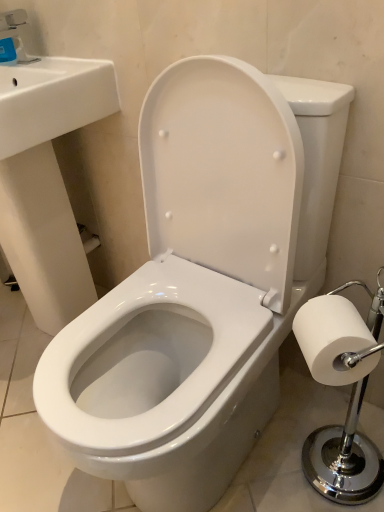
Question: Would you say matte blue plastic faucet at upper left is outside white paper at right?

Choices:
 (A) yes
 (B) no

Answer: (A)

Question: Is matte blue plastic faucet at upper left not near white paper at right?

Choices:
 (A) yes
 (B) no

Answer: (A)

Question: From the image's perspective, is matte blue plastic faucet at upper left on top of white paper at right?

Choices:
 (A) yes
 (B) no

Answer: (A)

Question: Does matte blue plastic faucet at upper left have a smaller size compared to white paper at right?

Choices:
 (A) yes
 (B) no

Answer: (A)

Question: Considering the relative sizes of matte blue plastic faucet at upper left and white paper at right in the image provided, is matte blue plastic faucet at upper left taller than white paper at right?

Choices:
 (A) yes
 (B) no

Answer: (A)

Question: Considering the positions of white paper at right and matte blue plastic faucet at upper left in the image, is white paper at right taller or shorter than matte blue plastic faucet at upper left?

Choices:
 (A) short
 (B) tall

Answer: (A)

Question: Is white paper at right to the left or to the right of matte blue plastic faucet at upper left in the image?

Choices:
 (A) right
 (B) left

Answer: (A)

Question: Considering the positions of point (314, 336) and point (23, 45), is point (314, 336) closer or farther from the camera than point (23, 45)?

Choices:
 (A) closer
 (B) farther

Answer: (A)

Question: From a real-world perspective, is white paper at right physically located above or below matte blue plastic faucet at upper left?

Choices:
 (A) below
 (B) above

Answer: (A)

Question: Based on their positions, is white glossy sink at upper left located to the left or right of matte blue plastic faucet at upper left?

Choices:
 (A) left
 (B) right

Answer: (B)

Question: Relative to matte blue plastic faucet at upper left, is white glossy sink at upper left in front or behind?

Choices:
 (A) behind
 (B) front

Answer: (B)

Question: Is white glossy sink at upper left bigger or smaller than matte blue plastic faucet at upper left?

Choices:
 (A) small
 (B) big

Answer: (B)

Question: From the image's perspective, is white glossy sink at upper left above or below matte blue plastic faucet at upper left?

Choices:
 (A) below
 (B) above

Answer: (A)

Question: In terms of width, does white glossy sink at upper left look wider or thinner when compared to white paper at right?

Choices:
 (A) thin
 (B) wide

Answer: (B)

Question: From the image's perspective, is white glossy sink at upper left located above or below white paper at right?

Choices:
 (A) above
 (B) below

Answer: (A)